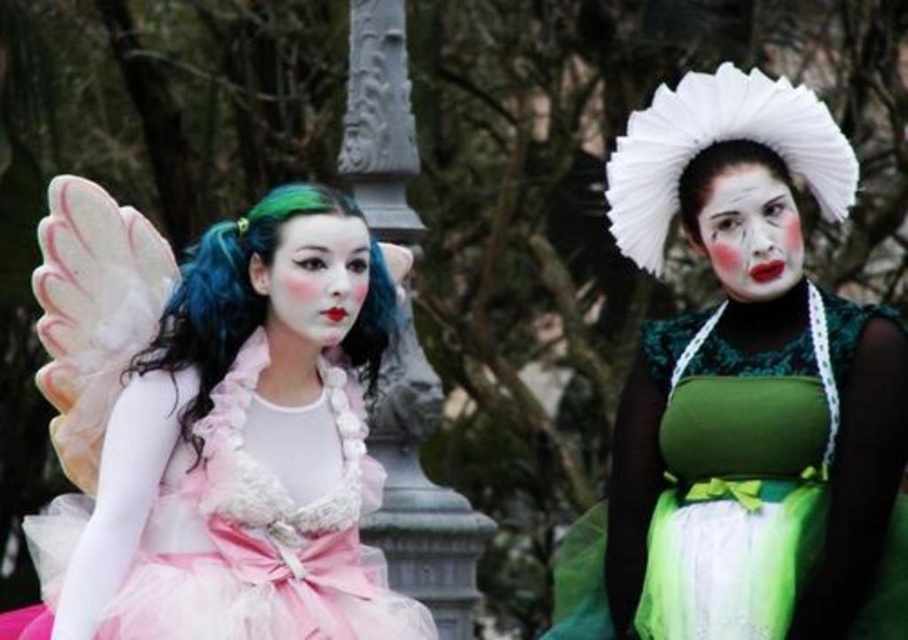
Question: Where is matte pink tulle face at center located in relation to white feathered wig at upper center in the image?

Choices:
 (A) above
 (B) below

Answer: (B)

Question: Which is farther from the green satin dress at center?

Choices:
 (A) matte pink tulle face at center
 (B) green silky wig at left
 (C) matte pink tulle dress at left
 (D) white feathered wig at upper center

Answer: (A)

Question: Observing the image, what is the correct spatial positioning of green satin dress at center in reference to white feathered wig at upper center?

Choices:
 (A) below
 (B) above

Answer: (A)

Question: Considering the relative positions of matte pink tulle dress at left and green silky wig at left in the image provided, where is matte pink tulle dress at left located with respect to green silky wig at left?

Choices:
 (A) below
 (B) above

Answer: (A)

Question: Estimate the real-world distances between objects in this image. Which object is farther from the matte pink tulle face at center?

Choices:
 (A) white feathered wig at upper center
 (B) matte white face at center
 (C) matte pink tulle dress at left
 (D) green satin dress at center

Answer: (D)

Question: Which object is farther from the camera taking this photo?

Choices:
 (A) matte pink tulle face at center
 (B) matte white face at center

Answer: (B)